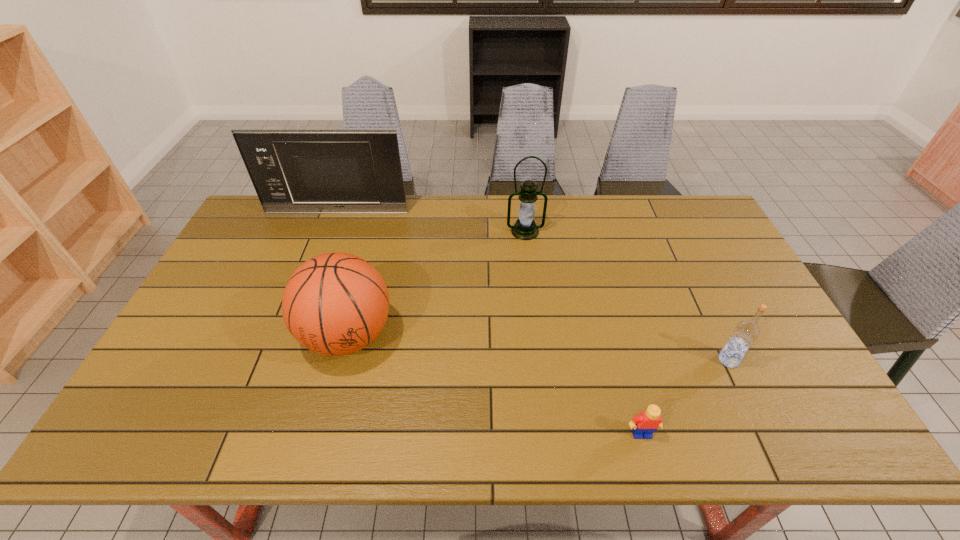
The image size is (960, 540). Find the location of `vacant area situated 0.170m on the front of the basketball`. vacant area situated 0.170m on the front of the basketball is located at coordinates (320, 443).

This screenshot has width=960, height=540. Find the location of `blank space located 0.080m on the front of the vodka`. blank space located 0.080m on the front of the vodka is located at coordinates (746, 397).

Where is `microwave oven that is at the far edge`? The image size is (960, 540). microwave oven that is at the far edge is located at coordinates (293, 171).

Identify the location of lantern that is at the far edge. This screenshot has width=960, height=540. (525, 228).

Find the location of a particular element. This screenshot has width=960, height=540. object at the near edge is located at coordinates (643, 425).

The image size is (960, 540). Find the location of `object located at the left edge`. object located at the left edge is located at coordinates (293, 171).

This screenshot has height=540, width=960. Find the location of `object that is positioned at the right edge`. object that is positioned at the right edge is located at coordinates (746, 332).

This screenshot has height=540, width=960. In order to click on object that is at the far left corner in this screenshot , I will do coord(293,171).

You are a GUI agent. You are given a task and a screenshot of the screen. Output one action in this format:
    pyautogui.click(x=<x>, y=<y>)
    Task: Click on the vacant space at the far edge
    The height and width of the screenshot is (540, 960).
    Given the screenshot: What is the action you would take?
    pyautogui.click(x=649, y=200)

Identify the location of vacant space at the near edge. The height and width of the screenshot is (540, 960). (636, 441).